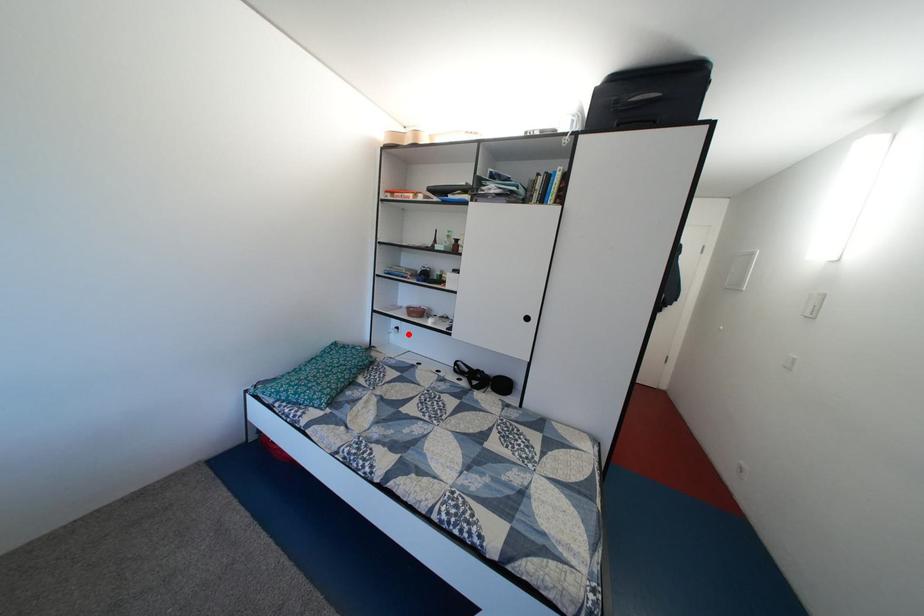
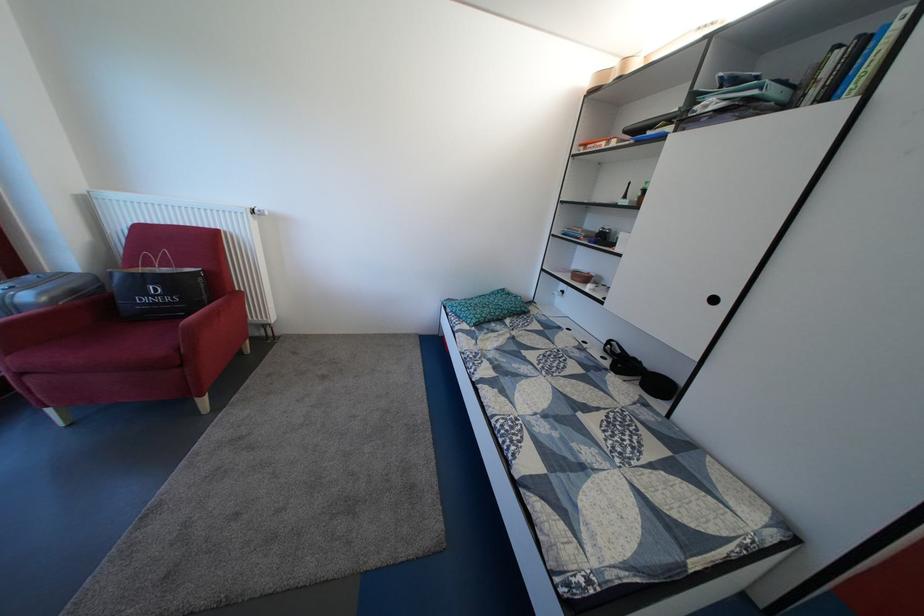
The point at the highlighted location is marked in the first image. Where is the corresponding point in the second image?

(574, 299)